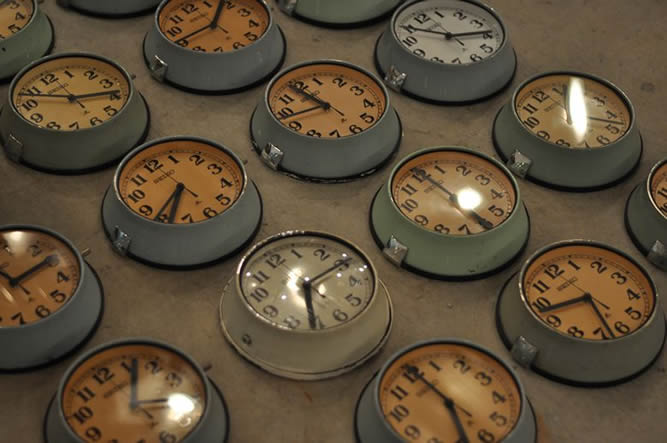
Image resolution: width=667 pixels, height=443 pixels. I want to click on clock 5, so click(x=581, y=107).